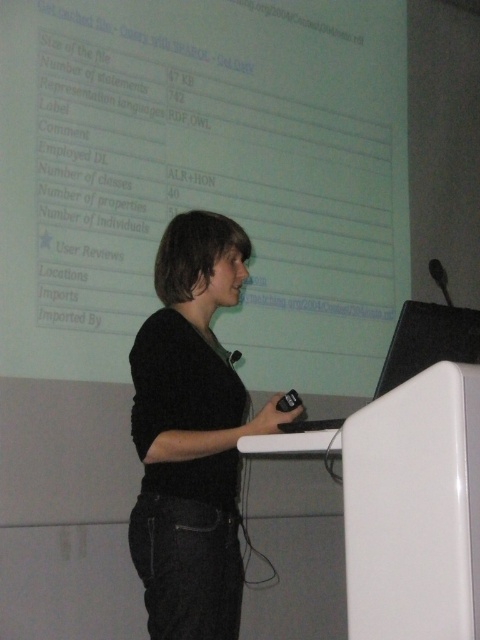
You are an attendee at the conference and want to take a photo of the slide on the white matte projection screen at upper center. However, you notice the black fuzzy sweater at center might be blocking your view. Based on their heights, can you determine if the sweater is likely obscuring the screen?

The white matte projection screen at upper center has a greater height compared to the black fuzzy sweater at center, meaning the screen is taller. Since the sweater is at center and the screen is above it, the lower part of the screen might still be visible above the sweater, but the sweater itself isn